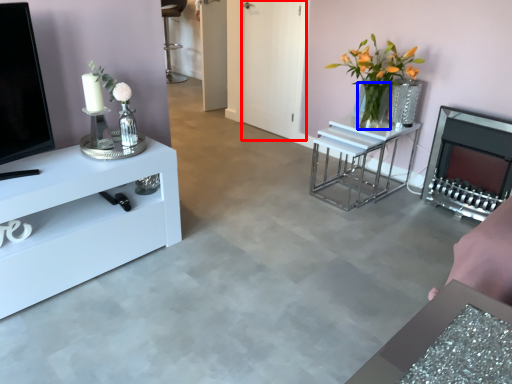
Question: Which object appears farthest to the camera in this image, glass door (highlighted by a red box) or glass vase (highlighted by a blue box)?

Choices:
 (A) glass door
 (B) glass vase

Answer: (A)